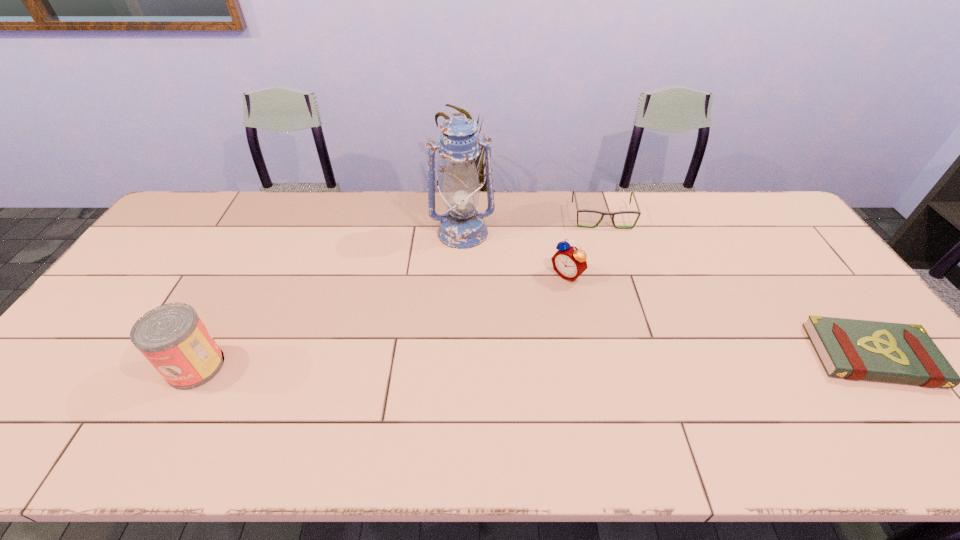
Find the location of `blank space at the near right corner of the desktop`. blank space at the near right corner of the desktop is located at coordinates (914, 385).

Identify the location of vacant area that lies between the shortest object and the spectacles. (737, 286).

What are the coordinates of `vacant point located between the fourth object from left to right and the tallest object` in the screenshot? It's located at (533, 225).

This screenshot has height=540, width=960. I want to click on unoccupied area between the leftmost object and the book, so click(534, 361).

The height and width of the screenshot is (540, 960). Identify the location of vacant area that lies between the leftmost object and the fourth tallest object. (399, 292).

You are a GUI agent. You are given a task and a screenshot of the screen. Output one action in this format:
    pyautogui.click(x=<x>, y=<y>)
    Task: Click on the free area in between the fourth shortest object and the spectacles
    
    Given the screenshot: What is the action you would take?
    pyautogui.click(x=399, y=292)

This screenshot has height=540, width=960. What are the coordinates of `vacant space that is in between the rightmost object and the tallest object` in the screenshot? It's located at (667, 294).

Find the location of a particular element. free space that is in between the second tallest object and the fourth object from right to left is located at coordinates (329, 299).

What are the coordinates of `vacant space that's between the can and the rightmost object` in the screenshot? It's located at (534, 361).

Identify the location of unoccupied position between the shortest object and the spectacles. (737, 286).